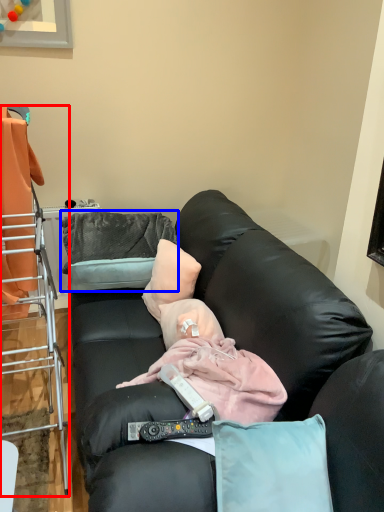
Question: Which object is further to the camera taking this photo, cabinetry (highlighted by a red box) or pillow (highlighted by a blue box)?

Choices:
 (A) cabinetry
 (B) pillow

Answer: (B)